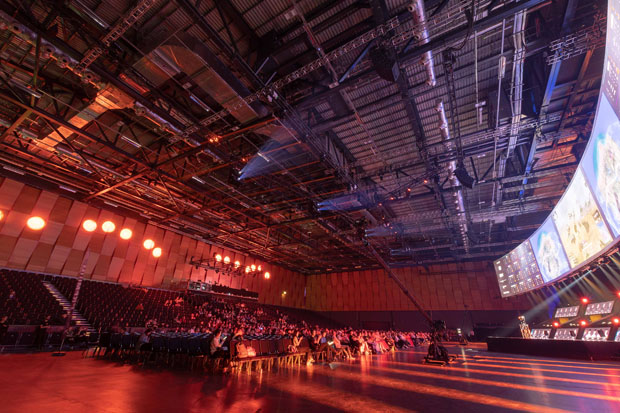
The height and width of the screenshot is (413, 620). I want to click on stands, so click(108, 310).